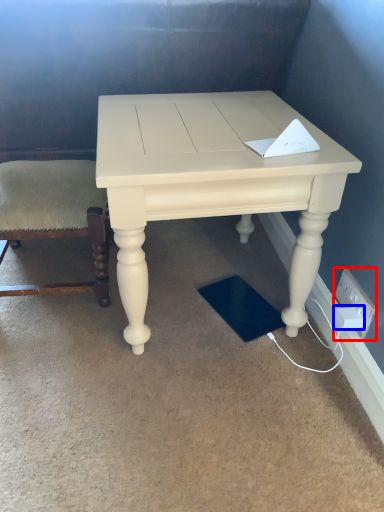
Question: Which object is closer to the camera taking this photo, electric outlet (highlighted by a red box) or socket (highlighted by a blue box)?

Choices:
 (A) electric outlet
 (B) socket

Answer: (A)